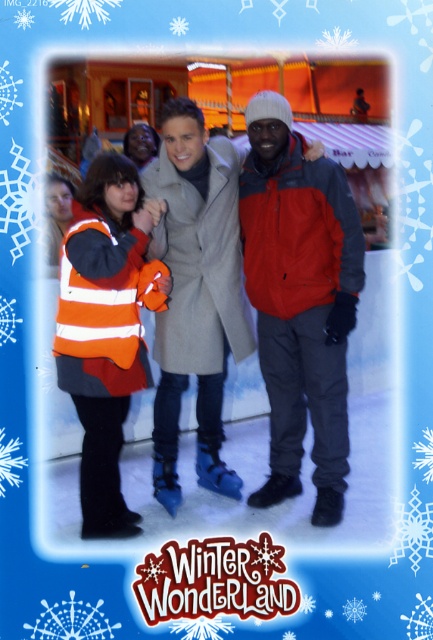
Between orange reflective vest at center and orange striped vest at center, which one is positioned lower?

Positioned lower is orange striped vest at center.

Measure the distance between orange reflective vest at center and orange striped vest at center.

orange reflective vest at center is 20.54 inches from orange striped vest at center.

Is point (180, 100) closer to viewer compared to point (64, 330)?

No, it is not.

I want to click on orange reflective vest at center, so click(x=255, y=292).

Does matte red jacket at center appear on the right side of orange striped vest at center?

Yes, matte red jacket at center is to the right of orange striped vest at center.

Is matte red jacket at center positioned in front of orange striped vest at center?

No, it is behind orange striped vest at center.

Who is more forward, (345, 195) or (89, 368)?

Point (89, 368) is more forward.

Locate an element on the screen. This screenshot has height=640, width=433. matte red jacket at center is located at coordinates (300, 298).

Can you confirm if orange reflective vest at center is taller than matte red jacket at center?

Indeed, orange reflective vest at center has a greater height compared to matte red jacket at center.

Which is above, orange reflective vest at center or matte red jacket at center?

orange reflective vest at center

I want to click on orange reflective vest at center, so click(x=255, y=292).

Where is `orange reflective vest at center`? orange reflective vest at center is located at coordinates (255, 292).